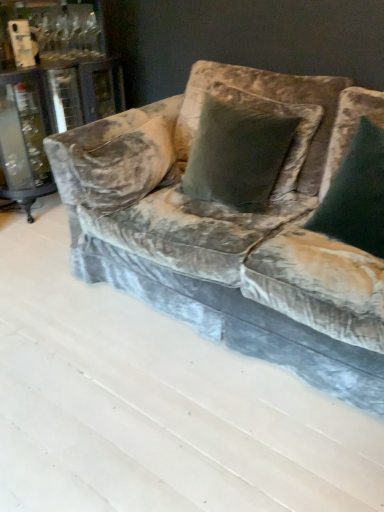
Question: Is dark green velvet pillow at center, which appears as the second pillow when viewed from the left, in contact with velvet couch at center?

Choices:
 (A) no
 (B) yes

Answer: (A)

Question: Is velvet couch at center surrounded by dark green velvet pillow at center, which appears as the second pillow when viewed from the left?

Choices:
 (A) no
 (B) yes

Answer: (A)

Question: Is dark green velvet pillow at center, which is counted as the first pillow, starting from the right, positioned behind velvet couch at center?

Choices:
 (A) yes
 (B) no

Answer: (A)

Question: Is dark green velvet pillow at center, which is counted as the first pillow, starting from the right, positioned far away from velvet couch at center?

Choices:
 (A) no
 (B) yes

Answer: (A)

Question: Does dark green velvet pillow at center, which appears as the second pillow when viewed from the left, have a lesser width compared to velvet couch at center?

Choices:
 (A) no
 (B) yes

Answer: (B)

Question: From a real-world perspective, is dark green velvet pillow at center, which appears as the second pillow when viewed from the left, above or below velvet couch at center?

Choices:
 (A) above
 (B) below

Answer: (A)

Question: Considering the positions of point (332, 216) and point (266, 334), is point (332, 216) closer or farther from the camera than point (266, 334)?

Choices:
 (A) closer
 (B) farther

Answer: (B)

Question: From the image's perspective, is dark green velvet pillow at center, which is counted as the first pillow, starting from the right, located above or below velvet couch at center?

Choices:
 (A) below
 (B) above

Answer: (B)

Question: Which is correct: dark green velvet pillow at center, which appears as the second pillow when viewed from the left, is inside velvet couch at center, or outside of it?

Choices:
 (A) outside
 (B) inside

Answer: (A)

Question: Is point (377, 155) closer or farther from the camera than point (210, 100)?

Choices:
 (A) farther
 (B) closer

Answer: (B)

Question: Considering the positions of dark green velvet pillow at center, which is counted as the first pillow, starting from the right, and velvet green pillow at center, which is the first pillow in left-to-right order, in the image, is dark green velvet pillow at center, which is counted as the first pillow, starting from the right, bigger or smaller than velvet green pillow at center, which is the first pillow in left-to-right order,?

Choices:
 (A) big
 (B) small

Answer: (B)

Question: From the image's perspective, is dark green velvet pillow at center, which is counted as the first pillow, starting from the right, positioned above or below velvet green pillow at center, which is the first pillow in left-to-right order?

Choices:
 (A) above
 (B) below

Answer: (B)

Question: Is dark green velvet pillow at center, which appears as the second pillow when viewed from the left, wider or thinner than velvet green pillow at center, which is the first pillow in left-to-right order?

Choices:
 (A) wide
 (B) thin

Answer: (B)

Question: From the image's perspective, is velvet green pillow at center, which is the first pillow in left-to-right order, located above or below velvet couch at center?

Choices:
 (A) above
 (B) below

Answer: (A)

Question: From a real-world perspective, is velvet green pillow at center, the second pillow positioned from the right, above or below velvet couch at center?

Choices:
 (A) below
 (B) above

Answer: (B)